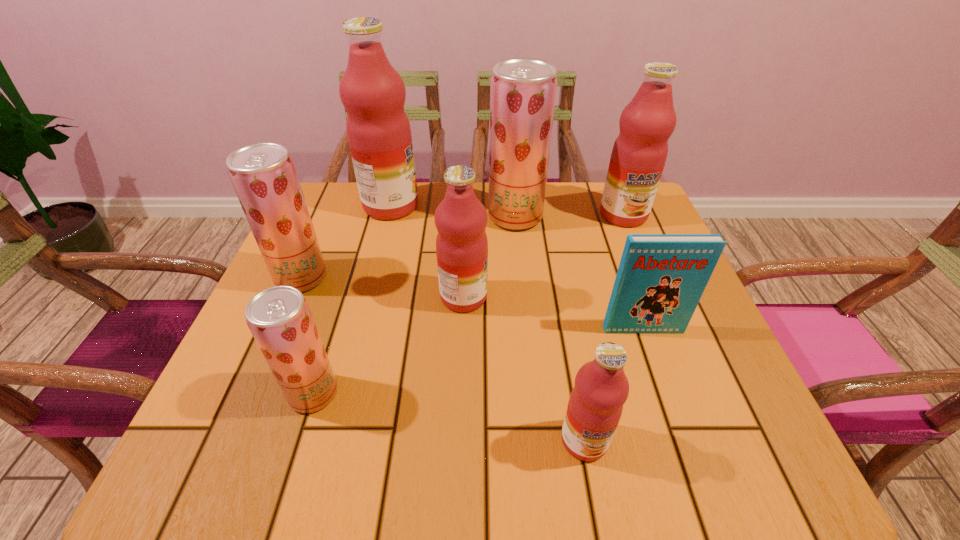
The height and width of the screenshot is (540, 960). In order to click on blue book in this screenshot , I will do `click(661, 278)`.

Where is `book`? The image size is (960, 540). book is located at coordinates (661, 278).

Where is `the second strawberry fruit juice from right to left`? The image size is (960, 540). the second strawberry fruit juice from right to left is located at coordinates point(279,318).

I want to click on the second nearest fruit juice, so click(x=279, y=318).

What are the coordinates of `the third pink fruit juice from left to right` in the screenshot? It's located at click(601, 388).

The height and width of the screenshot is (540, 960). Identify the location of the nearest pink fruit juice. (601, 388).

Image resolution: width=960 pixels, height=540 pixels. In order to click on vacant space positioned on the label of the tallest fruit juice in this screenshot , I will do `click(489, 206)`.

Where is `free space located on the left of the biggest strawberry fruit juice`? This screenshot has width=960, height=540. free space located on the left of the biggest strawberry fruit juice is located at coordinates (355, 217).

In order to click on vacant space located on the label of the third smallest pink fruit juice in this screenshot , I will do `click(653, 287)`.

You are a GUI agent. You are given a task and a screenshot of the screen. Output one action in this format:
    pyautogui.click(x=<x>, y=<y>)
    Task: Click on the vacant area situated on the right of the leftmost fruit juice
    
    Given the screenshot: What is the action you would take?
    pyautogui.click(x=483, y=278)